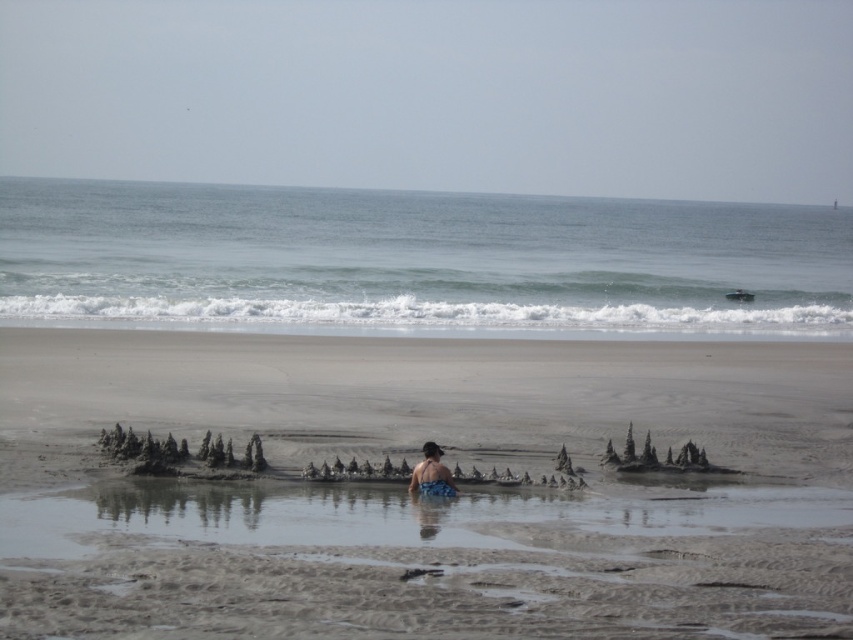
You are standing on the beach and want to take a photo of the blue water at center. Where should you aim your camera to capture it?

You should aim your camera at point coordinates (416, 260) to capture the blue water at center.